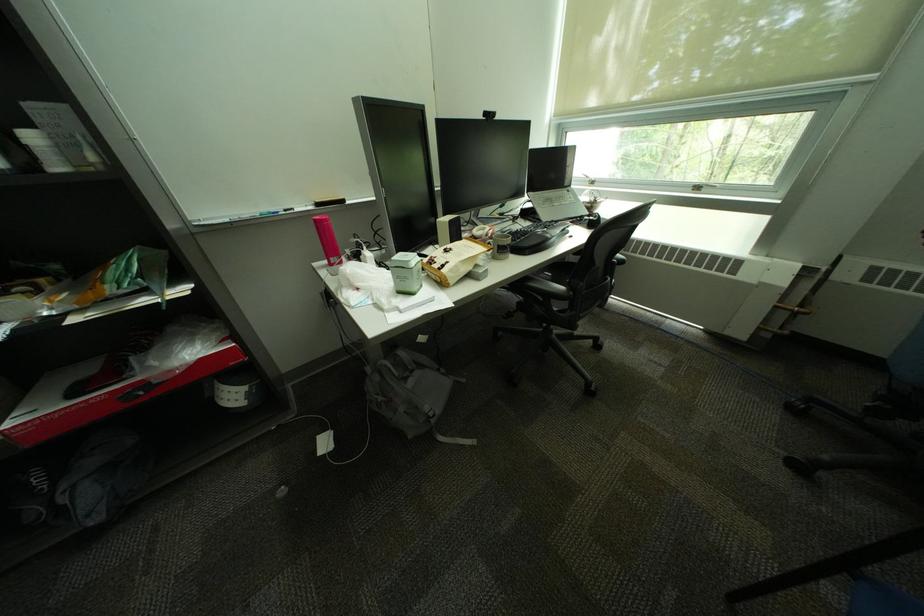
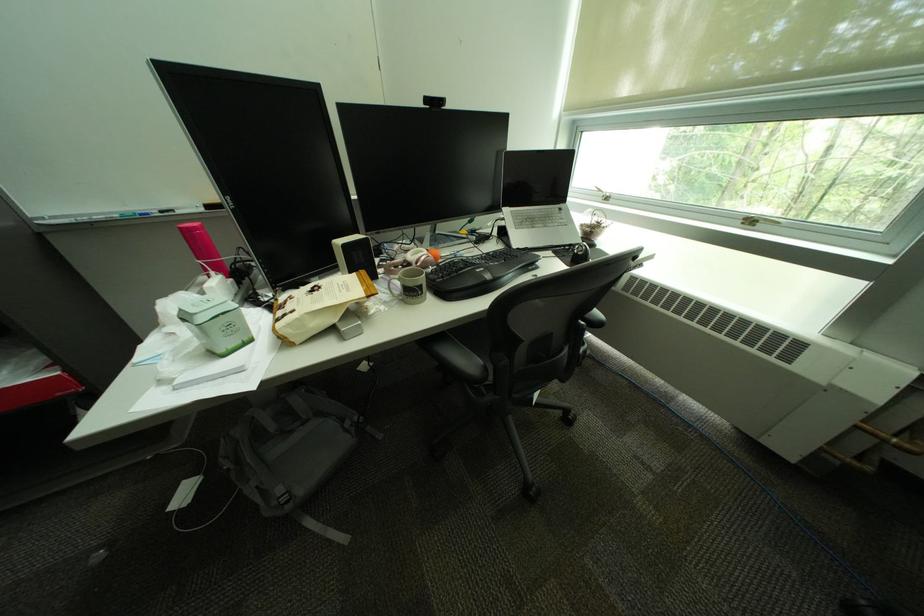
Find the pixel in the second image that matches point 444,422 in the first image.

(299, 508)